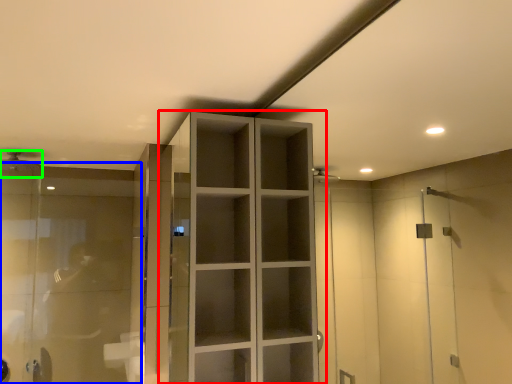
Question: Based on their relative distances, which object is farther from cupboard (highlighted by a red box)? Choose from glass door (highlighted by a blue box) and shower (highlighted by a green box).

Choices:
 (A) glass door
 (B) shower

Answer: (B)